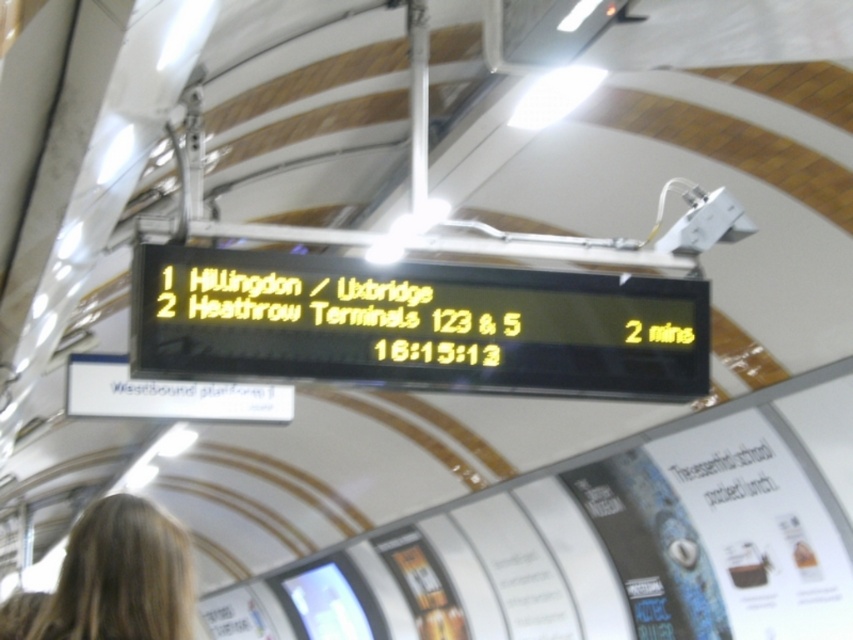
Looking at this image, measure the distance between yellow led display at center and blonde hair at lower left.

yellow led display at center is 8.35 feet away from blonde hair at lower left.

Does yellow led display at center have a smaller size compared to blonde hair at lower left?

No, yellow led display at center is not smaller than blonde hair at lower left.

Locate an element on the screen. The height and width of the screenshot is (640, 853). yellow led display at center is located at coordinates (415, 324).

Find the location of a particular element. yellow led display at center is located at coordinates (415, 324).